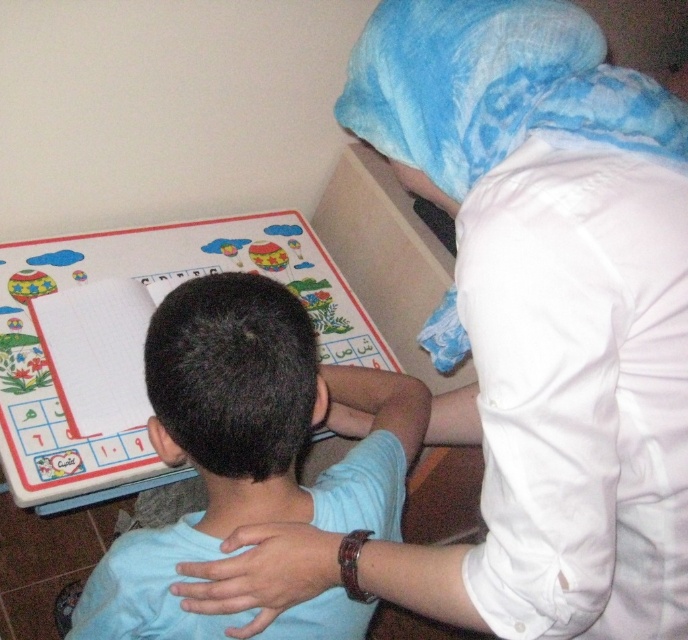
You are standing in front of the table where the child is working. There are two points marked on the table. One is at coordinates point (204, 472) and the other is at point (420, 113). If you want to place a sticker closer to the camera, which point should you choose?

You should choose point (204, 472) because it is further to the camera than point (420, 113).

You are a photographer taking a picture of the scene. The light blue shirt at center and the blue fabric at upper right are both in the frame. Which one is larger in the photo?

The light blue shirt at center is bigger than blue fabric at upper right, so the light blue shirt at center appears larger in the photo.